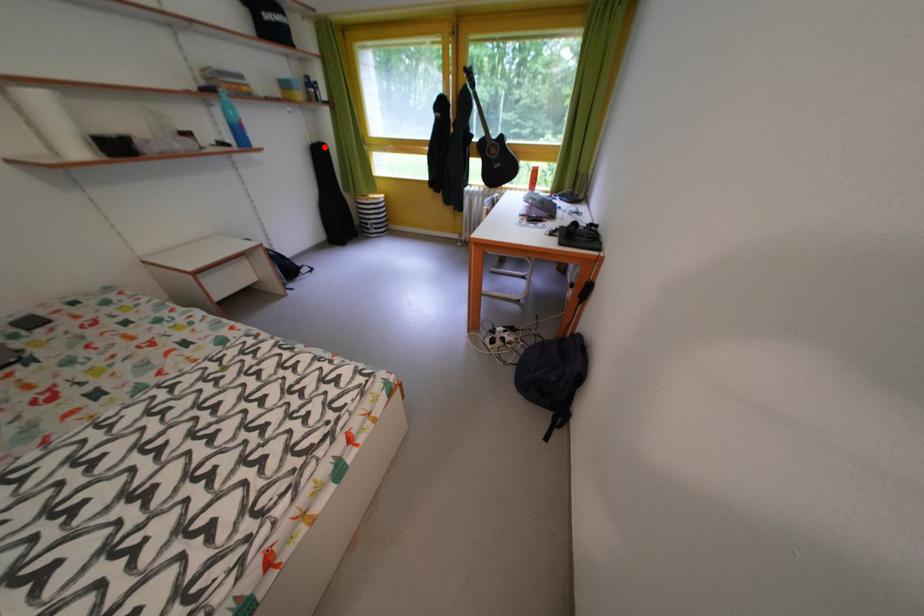
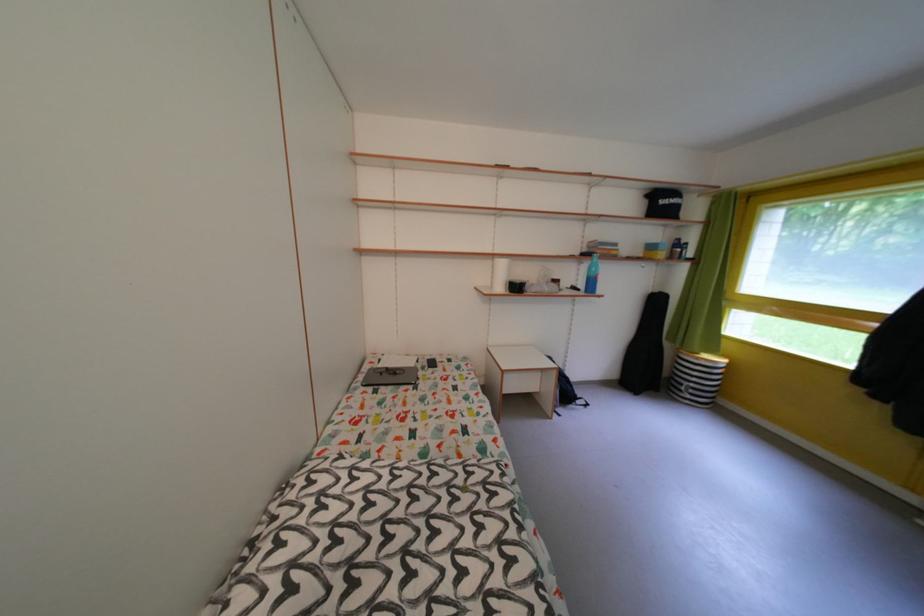
The point at the highlighted location is marked in the first image. Where is the corresponding point in the second image?

(665, 296)